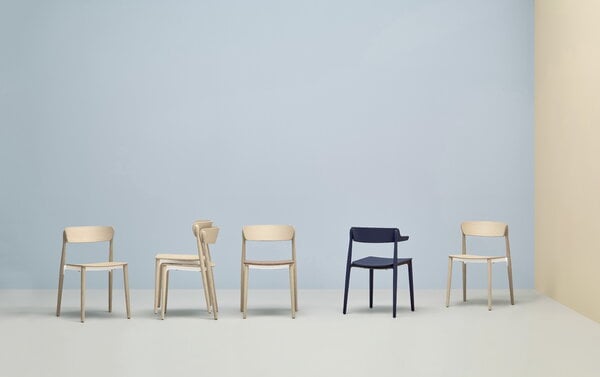
Find the location of `shadow under the chair`. shadow under the chair is located at coordinates (97, 314), (177, 311), (261, 309), (383, 310), (478, 302).